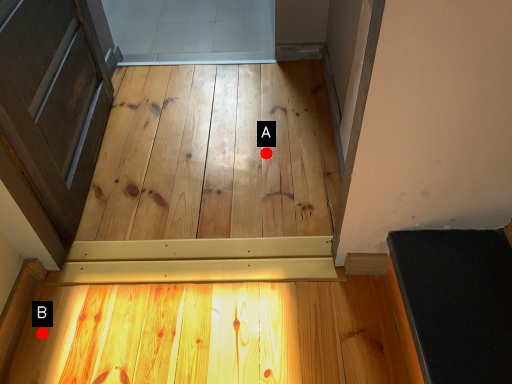
Question: Two points are circled on the image, labeled by A and B beside each circle. Which point is closer to the camera taking this photo?

Choices:
 (A) A is closer
 (B) B is closer

Answer: (B)